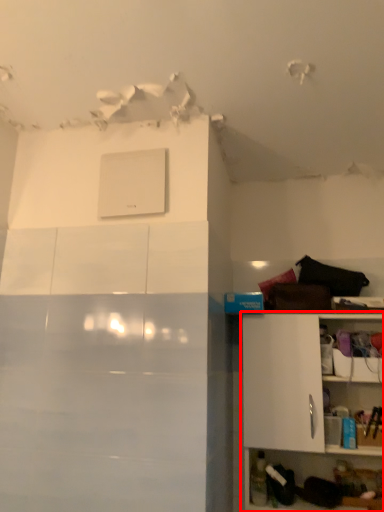
Question: In this image, where is shelf (annotated by the red box) located relative to appliance?

Choices:
 (A) right
 (B) left

Answer: (A)